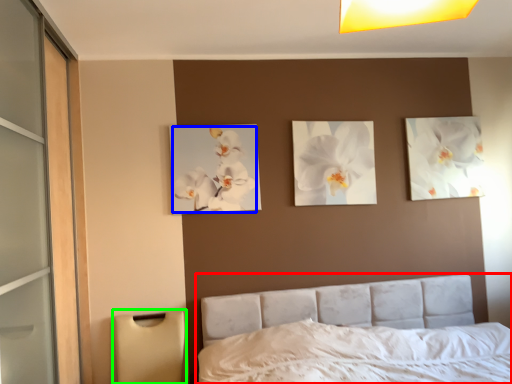
Question: Which object is positioned closest to bed (highlighted by a red box)? Select from flower (highlighted by a blue box) and lamp (highlighted by a green box).

Choices:
 (A) flower
 (B) lamp

Answer: (B)